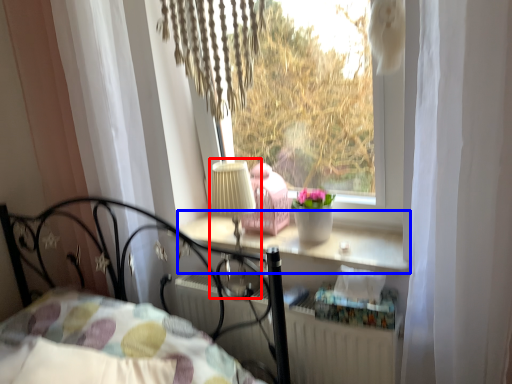
Question: Which point is further to the camera, table lamp (highlighted by a red box) or window sill (highlighted by a blue box)?

Choices:
 (A) table lamp
 (B) window sill

Answer: (A)